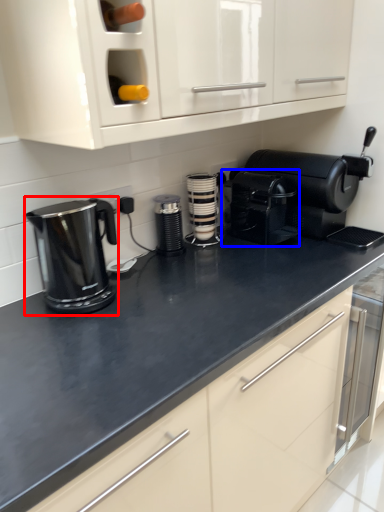
Question: Which object is closer to the camera taking this photo, home appliance (highlighted by a red box) or coffeepot (highlighted by a blue box)?

Choices:
 (A) home appliance
 (B) coffeepot

Answer: (A)